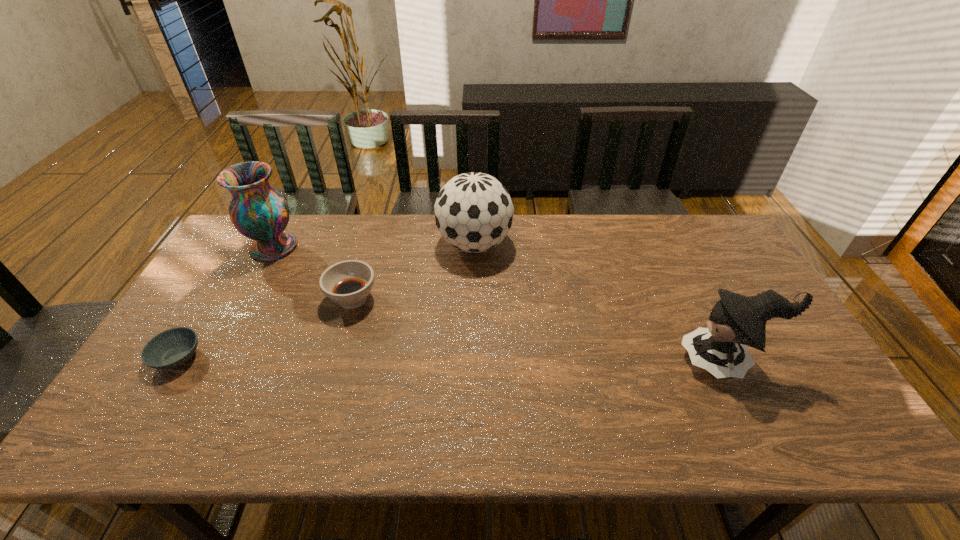
Locate an element on the screen. The width and height of the screenshot is (960, 540). vacant area that lies between the doll and the soccer ball is located at coordinates (600, 302).

Where is `free spot between the shortest object and the vase`? The width and height of the screenshot is (960, 540). free spot between the shortest object and the vase is located at coordinates (226, 302).

The image size is (960, 540). I want to click on vacant area that lies between the taller soup bowl and the vase, so click(313, 273).

This screenshot has height=540, width=960. Find the location of `vacant space that's between the third object from left to right and the soccer ball`. vacant space that's between the third object from left to right and the soccer ball is located at coordinates (414, 272).

Image resolution: width=960 pixels, height=540 pixels. Identify the location of object that is the closest to the rightmost object. (473, 211).

Where is `object that ranks as the second closest to the fourth object from left to right`? This screenshot has width=960, height=540. object that ranks as the second closest to the fourth object from left to right is located at coordinates 259,212.

I want to click on vacant region that satisfies the following two spatial constraints: 1. on the front side of the vase; 2. on the right side of the right soup bowl, so click(246, 299).